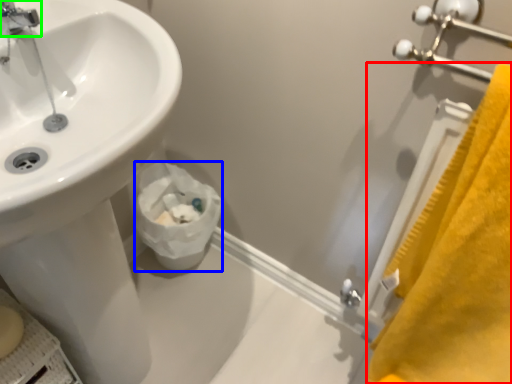
Question: Based on their relative distances, which object is nearer to bath towel (highlighted by a red box)? Choose from toilet paper (highlighted by a blue box) and tap (highlighted by a green box).

Choices:
 (A) toilet paper
 (B) tap

Answer: (A)